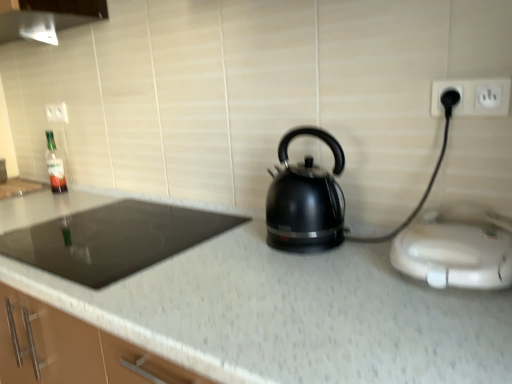
What is the approximate height of black plastic electric outlet at upper right, positioned as the 2th electric outlet in back-to-front order?

It is 3.20 inches.

Identify the location of black plastic electric outlet at upper right, marked as the first electric outlet in a right-to-left arrangement. pos(473,97).

The image size is (512, 384). I want to click on white granite countertop at center, so click(x=292, y=315).

This screenshot has height=384, width=512. What do you see at coordinates (57, 112) in the screenshot?
I see `white plastic electric outlet at upper center, which is the first electric outlet from left to right` at bounding box center [57, 112].

Find the location of `black glass cooktop at left`. black glass cooktop at left is located at coordinates (113, 239).

Find the location of a particular element. black plastic electric outlet at upper right, which is the 2th electric outlet in left-to-right order is located at coordinates (473, 97).

Which of these two, black glass cooktop at left or white plastic electric outlet at upper center, which is counted as the 2th electric outlet, starting from the front, is wider?

black glass cooktop at left is wider.

From the image's perspective, is black glass cooktop at left beneath white plastic electric outlet at upper center, the 2th electric outlet viewed from the right?

Indeed, from the image's perspective, black glass cooktop at left is shown beneath white plastic electric outlet at upper center, the 2th electric outlet viewed from the right.

What are the coordinates of `gas stove in front of the white plastic electric outlet at upper center, which is the second electric outlet in bottom-to-top order` in the screenshot? It's located at (113, 239).

Is the depth of black glass cooktop at left less than that of white plastic electric outlet at upper center, which is counted as the 2th electric outlet, starting from the front?

Yes, black glass cooktop at left is in front of white plastic electric outlet at upper center, which is counted as the 2th electric outlet, starting from the front.

Would you say white plastic toaster at right is a long distance from white granite countertop at center?

No, white plastic toaster at right is not far away from white granite countertop at center.

Is white plastic toaster at right smaller than white granite countertop at center?

Indeed, white plastic toaster at right has a smaller size compared to white granite countertop at center.

From the picture: Between white plastic toaster at right and white granite countertop at center, which one is positioned behind?

white plastic toaster at right is further away from the camera.

Who is shorter, white plastic toaster at right or white granite countertop at center?

With less height is white plastic toaster at right.

Is black plastic electric outlet at upper right, arranged as the 1th electric outlet when viewed from the front, beside black glossy kettle at center?

No, black plastic electric outlet at upper right, arranged as the 1th electric outlet when viewed from the front, is not next to black glossy kettle at center.

Between black plastic electric outlet at upper right, arranged as the 1th electric outlet when viewed from the front, and black glossy kettle at center, which one has smaller width?

black plastic electric outlet at upper right, arranged as the 1th electric outlet when viewed from the front.

From the image's perspective, is black plastic electric outlet at upper right, arranged as the first electric outlet when ordered from the bottom, located beneath black glossy kettle at center?

No, from the image's perspective, black plastic electric outlet at upper right, arranged as the first electric outlet when ordered from the bottom, is not beneath black glossy kettle at center.

Can you confirm if black plastic electric outlet at upper right, marked as the first electric outlet in a right-to-left arrangement, is positioned to the right of black glossy kettle at center?

Yes, black plastic electric outlet at upper right, marked as the first electric outlet in a right-to-left arrangement, is to the right of black glossy kettle at center.

From the image's perspective, which one is positioned lower, translucent glass bottle at left or white plastic electric outlet at upper center, the first electric outlet from the back?

From the image's view, translucent glass bottle at left is below.

Does translucent glass bottle at left have a greater width compared to white plastic electric outlet at upper center, which is the second electric outlet in bottom-to-top order?

Indeed, translucent glass bottle at left has a greater width compared to white plastic electric outlet at upper center, which is the second electric outlet in bottom-to-top order.

Is translucent glass bottle at left bigger or smaller than white plastic electric outlet at upper center, which is the first electric outlet in top-to-bottom order?

In the image, translucent glass bottle at left appears to be larger than white plastic electric outlet at upper center, which is the first electric outlet in top-to-bottom order.

Relative to white plastic electric outlet at upper center, which is counted as the 2th electric outlet, starting from the front, is translucent glass bottle at left in front or behind?

translucent glass bottle at left is positioned closer to the viewer than white plastic electric outlet at upper center, which is counted as the 2th electric outlet, starting from the front.

Considering the sizes of objects black glossy kettle at center and white plastic toaster at right in the image provided, who is smaller, black glossy kettle at center or white plastic toaster at right?

Smaller between the two is white plastic toaster at right.

From the image's perspective, relative to white plastic toaster at right, is black glossy kettle at center above or below?

black glossy kettle at center is above white plastic toaster at right.

Is point (329, 237) positioned behind point (419, 248)?

Yes, it is behind point (419, 248).

Could you measure the distance between white granite countertop at center and black plastic electric outlet at upper right, arranged as the first electric outlet when ordered from the bottom?

A distance of 21.20 inches exists between white granite countertop at center and black plastic electric outlet at upper right, arranged as the first electric outlet when ordered from the bottom.

Is point (162, 347) positioned in front of point (486, 91)?

Yes, point (162, 347) is in front of point (486, 91).

Is white granite countertop at center in front of or behind black plastic electric outlet at upper right, arranged as the 1th electric outlet when viewed from the front, in the image?

white granite countertop at center is positioned closer to the viewer than black plastic electric outlet at upper right, arranged as the 1th electric outlet when viewed from the front.

Is black glass cooktop at left inside or outside of translucent glass bottle at left?

black glass cooktop at left is outside translucent glass bottle at left.

Is point (33, 226) closer or farther from the camera than point (46, 155)?

Point (33, 226) appears to be closer to the viewer than point (46, 155).

Consider the image. Does black glass cooktop at left appear on the right side of translucent glass bottle at left?

Indeed, black glass cooktop at left is positioned on the right side of translucent glass bottle at left.

Find the location of `gas stove on the right of white plastic electric outlet at upper center, which is the first electric outlet in top-to-bottom order`. gas stove on the right of white plastic electric outlet at upper center, which is the first electric outlet in top-to-bottom order is located at coordinates (113, 239).

Identify the location of appliance that is above the white granite countertop at center (from the image's perspective). This screenshot has height=384, width=512. (457, 248).

When comparing their distances from black glass cooktop at left, does white plastic electric outlet at upper center, which is counted as the 2th electric outlet, starting from the front, or black glossy kettle at center seem closer?

black glossy kettle at center is positioned closer to the anchor black glass cooktop at left.

Looking at the image, which one is located further to translucent glass bottle at left, black glossy kettle at center or black glass cooktop at left?

black glossy kettle at center lies further to translucent glass bottle at left than the other object.

Based on their spatial positions, is black glass cooktop at left or white plastic electric outlet at upper center, the 2th electric outlet viewed from the right, further from translucent glass bottle at left?

Based on the image, black glass cooktop at left appears to be further to translucent glass bottle at left.

Estimate the real-world distances between objects in this image. Which object is closer to white plastic electric outlet at upper center, the first electric outlet from the back, translucent glass bottle at left or black glossy kettle at center?

Among the two, translucent glass bottle at left is located nearer to white plastic electric outlet at upper center, the first electric outlet from the back.

Which object lies nearer to the anchor point black glossy kettle at center, white plastic electric outlet at upper center, the first electric outlet from the back, or translucent glass bottle at left?

translucent glass bottle at left is closer to black glossy kettle at center.

Based on their spatial positions, is black glass cooktop at left or white granite countertop at center further from black glossy kettle at center?

Among the two, black glass cooktop at left is located further to black glossy kettle at center.

Based on their spatial positions, is white plastic electric outlet at upper center, the first electric outlet from the back, or black plastic electric outlet at upper right, positioned as the 2th electric outlet in back-to-front order, closer to black glass cooktop at left?

white plastic electric outlet at upper center, the first electric outlet from the back, is closer to black glass cooktop at left.

Considering their positions, is white granite countertop at center positioned further to white plastic electric outlet at upper center, the first electric outlet from the back, than translucent glass bottle at left?

The object further to white plastic electric outlet at upper center, the first electric outlet from the back, is white granite countertop at center.

Locate an element on the screen. gas stove located between white plastic electric outlet at upper center, which is the first electric outlet from left to right, and black plastic electric outlet at upper right, which is the 2th electric outlet in left-to-right order, in the left-right direction is located at coordinates (113, 239).

Identify the location of kettle between white granite countertop at center and translucent glass bottle at left from front to back. The image size is (512, 384). (305, 200).

The width and height of the screenshot is (512, 384). I want to click on bottle positioned between white granite countertop at center and white plastic electric outlet at upper center, which is the first electric outlet from left to right, from near to far, so click(x=55, y=165).

Find the location of a particular element. Image resolution: width=512 pixels, height=384 pixels. bottle situated between white plastic electric outlet at upper center, the first electric outlet from the back, and white plastic toaster at right from left to right is located at coordinates (55, 165).